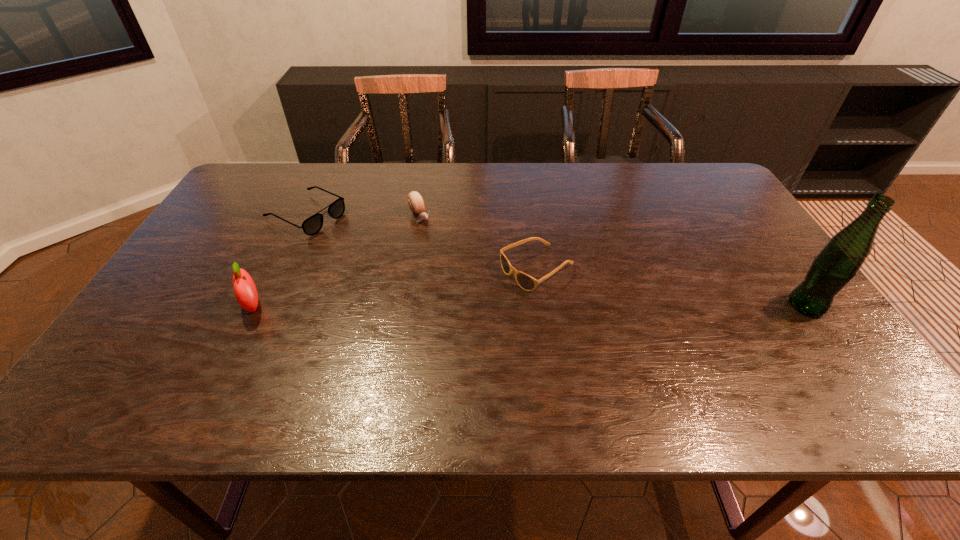
Where is `apple`? apple is located at coordinates (245, 291).

I want to click on beer bottle, so click(x=837, y=264).

The width and height of the screenshot is (960, 540). Find the location of `the rightmost object`. the rightmost object is located at coordinates (837, 264).

Image resolution: width=960 pixels, height=540 pixels. What are the coordinates of `the third object from right to left` in the screenshot? It's located at (415, 201).

At what (x,y) coordinates should I click in order to perform the action: click on escargot. Please return your answer as a coordinate pair (x, y). Looking at the image, I should click on (415, 201).

You are a GUI agent. You are given a task and a screenshot of the screen. Output one action in this format:
    pyautogui.click(x=<x>, y=<y>)
    Task: Click on the spectacles
    Image resolution: width=960 pixels, height=540 pixels.
    Given the screenshot: What is the action you would take?
    pyautogui.click(x=312, y=225)

The image size is (960, 540). I want to click on the second object from right to left, so tap(526, 282).

What are the coordinates of `vacant area situated on the left of the apple` in the screenshot? It's located at (192, 306).

Where is `free location located on the left of the rightmost object`? The image size is (960, 540). free location located on the left of the rightmost object is located at coordinates (652, 306).

Where is `free space located on the front-facing side of the third object from right to left`? The width and height of the screenshot is (960, 540). free space located on the front-facing side of the third object from right to left is located at coordinates (447, 259).